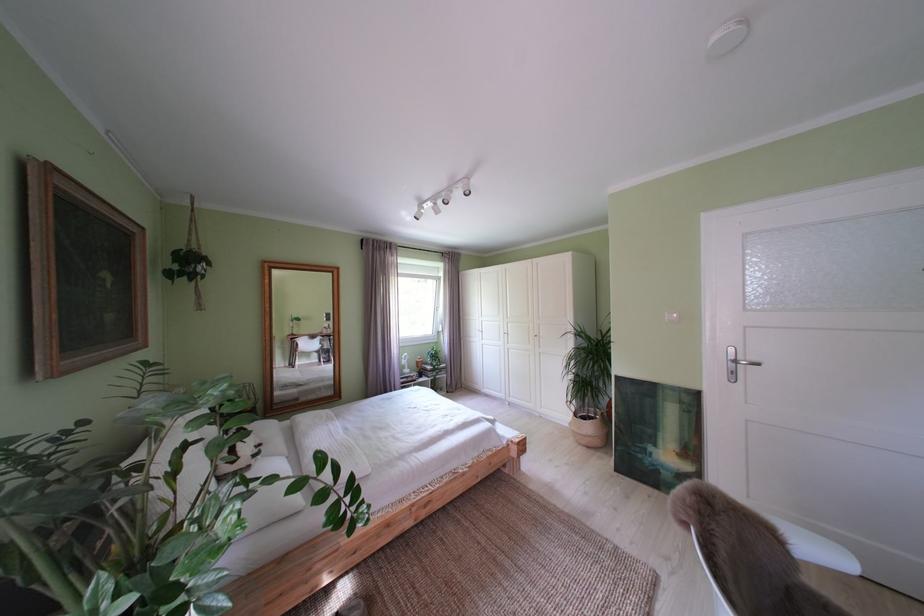
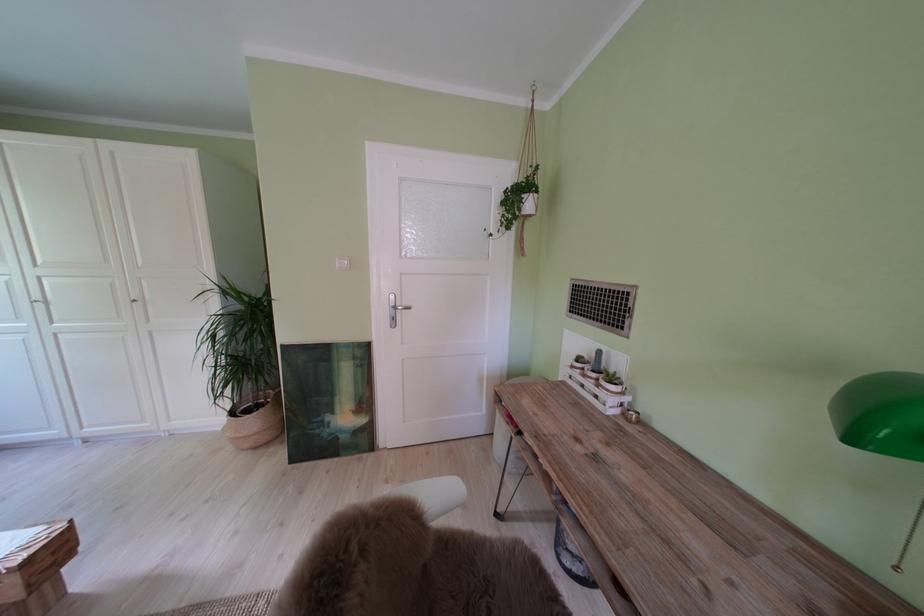
Locate, in the second image, the point that corresponds to pixel 587 419 in the first image.

(242, 418)